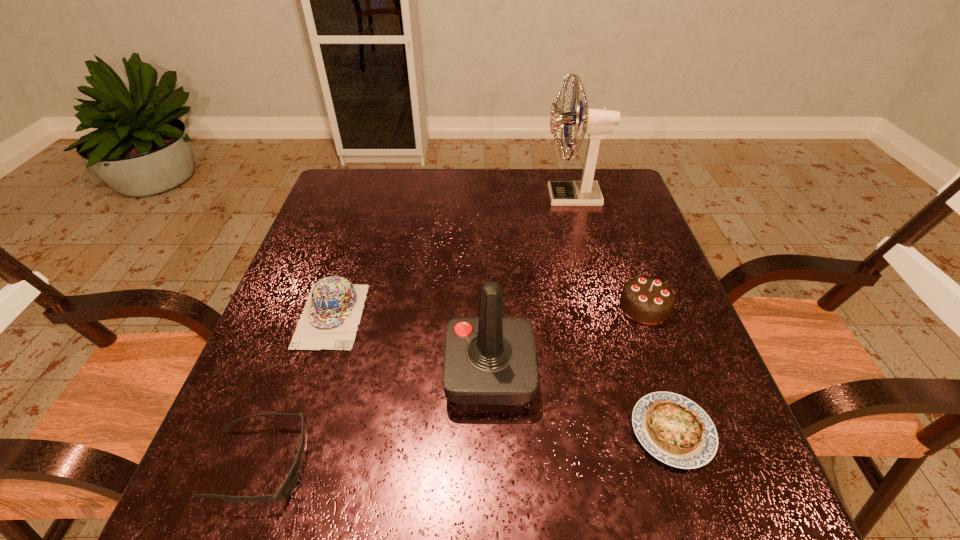
Find the location of a particular element. This screenshot has height=540, width=960. free space at the right edge is located at coordinates (612, 300).

Find the location of a particular element. The image size is (960, 540). free location at the far left corner of the desktop is located at coordinates (336, 196).

Identify the location of vacant space at the near left corner of the desktop. (193, 495).

Image resolution: width=960 pixels, height=540 pixels. Identify the location of free space at the near right corner. tap(661, 469).

What are the coordinates of `free space between the fourth tallest object and the farthest object` in the screenshot? It's located at click(x=452, y=256).

Where is `free space between the third shortest object and the tallest object`? The width and height of the screenshot is (960, 540). free space between the third shortest object and the tallest object is located at coordinates pos(452,256).

Identify the location of free spot between the quiche and the chocolate cake. This screenshot has width=960, height=540. (659, 369).

Where is `vacant point located between the chocolate cake and the third object from left to right`? The width and height of the screenshot is (960, 540). vacant point located between the chocolate cake and the third object from left to right is located at coordinates (566, 340).

Identify the location of vacant point located between the fifth shortest object and the quiche. (581, 402).

The width and height of the screenshot is (960, 540). In order to click on vacant space in between the sunglasses and the fan in this screenshot , I will do `click(416, 330)`.